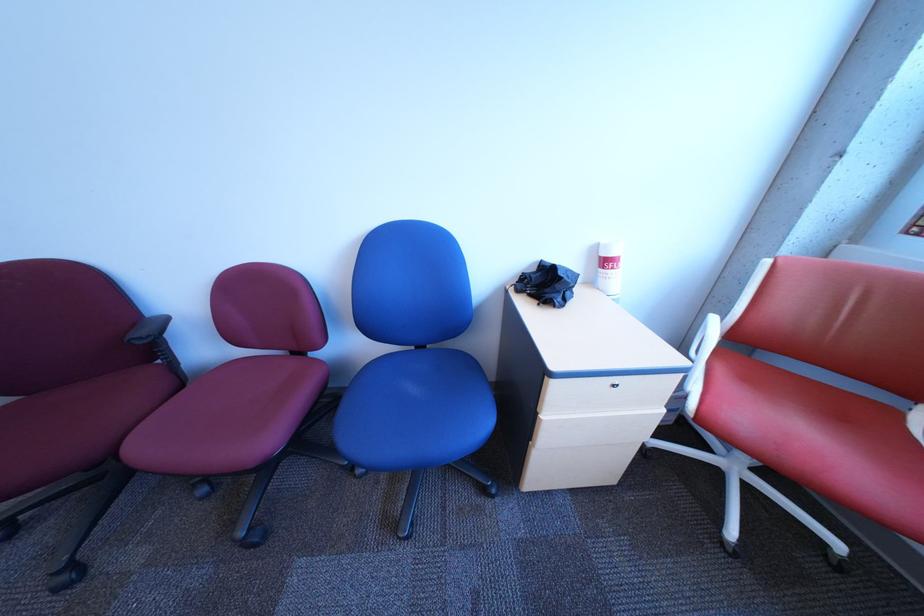
This screenshot has width=924, height=616. I want to click on white spray bottle, so tap(610, 267).